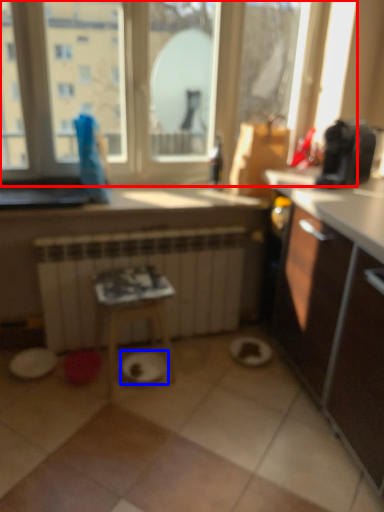
Question: Which of the following is the farthest to the observer, window (highlighted by a red box) or paper plate (highlighted by a blue box)?

Choices:
 (A) window
 (B) paper plate

Answer: (B)